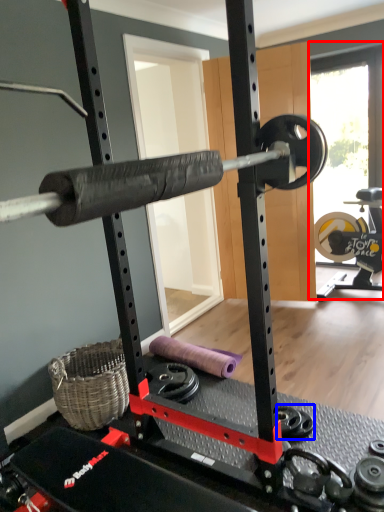
Question: Which object is further to the camera taking this photo, window screen (highlighted by a red box) or dumbbell (highlighted by a blue box)?

Choices:
 (A) window screen
 (B) dumbbell

Answer: (A)